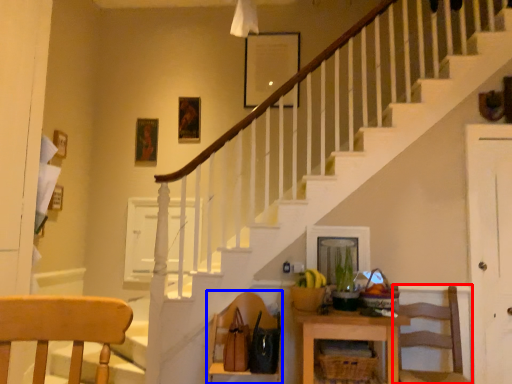
Question: Which of the following is the closest to the observer, chair (highlighted by a red box) or chair (highlighted by a blue box)?

Choices:
 (A) chair
 (B) chair

Answer: (A)